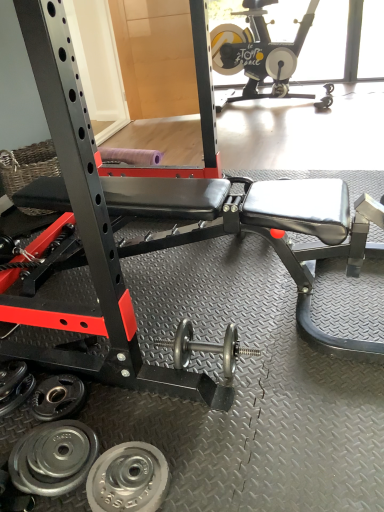
You are a GUI agent. You are given a task and a screenshot of the screen. Output one action in this format:
    pyautogui.click(x=<x>, y=<y>)
    Task: Click on the vacant area that is in front of polished silver dumbbell at center
    
    Given the screenshot: What is the action you would take?
    pyautogui.click(x=222, y=430)